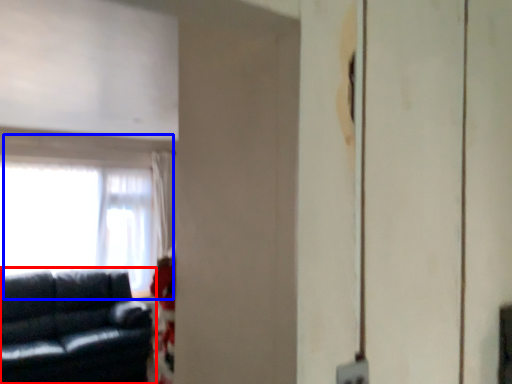
Question: Which object appears farthest to the camera in this image, studio couch (highlighted by a red box) or window (highlighted by a blue box)?

Choices:
 (A) studio couch
 (B) window

Answer: (B)